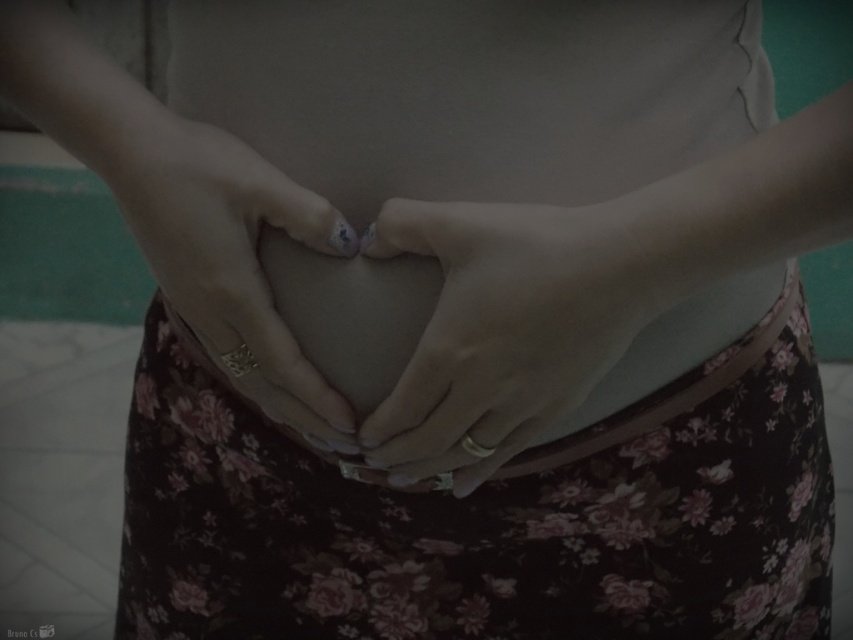
You are a photographer adjusting the focus on your camera. You notice two points in the image at coordinates point (x=648, y=189) and point (x=189, y=128). Which point should you focus on to ensure the foreground is sharp?

You should focus on point (x=648, y=189) because it is in front of point (x=189, y=128), making it part of the foreground.

You are a tailor who needs to adjust the placement of the matte gold ring at center so that it is closer to the floral fabric dress at center. According to the current measurements, how much distance do you need to move the ring to make them touch?

The floral fabric dress at center is currently 8.12 inches away from the matte gold ring at center. To make them touch, you need to move the ring by 8.12 inches towards the dress.